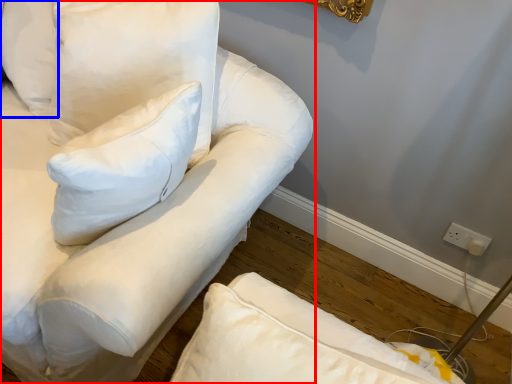
Question: Which object is closer to the camera taking this photo, furniture (highlighted by a red box) or pillow (highlighted by a blue box)?

Choices:
 (A) furniture
 (B) pillow

Answer: (A)